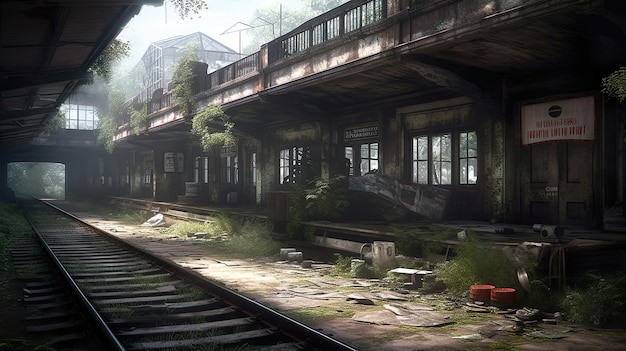
Where is `trash`? This screenshot has width=626, height=351. trash is located at coordinates (406, 319), (394, 296), (325, 269), (558, 337).